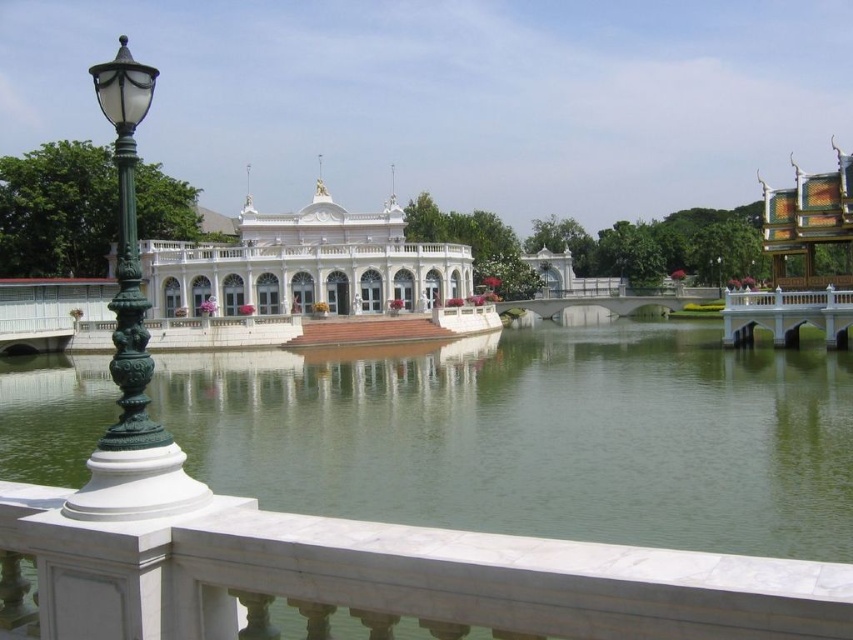
Question: Which object is closer to the camera taking this photo?

Choices:
 (A) white marble palace at center
 (B) green ornate metal lamp post at left
 (C) green water at center

Answer: (B)

Question: Is white marble palace at center to the right of green ornate metal lamp post at left from the viewer's perspective?

Choices:
 (A) yes
 (B) no

Answer: (A)

Question: Does white marble palace at center appear over green ornate metal lamp post at left?

Choices:
 (A) yes
 (B) no

Answer: (B)

Question: Which point is farther from the camera taking this photo?

Choices:
 (A) (612, 454)
 (B) (102, 438)

Answer: (B)

Question: Is green water at center closer to camera compared to green ornate metal lamp post at left?

Choices:
 (A) no
 (B) yes

Answer: (A)

Question: Which point appears closest to the camera in this image?

Choices:
 (A) (258, 385)
 (B) (128, 209)
 (C) (291, 257)

Answer: (B)